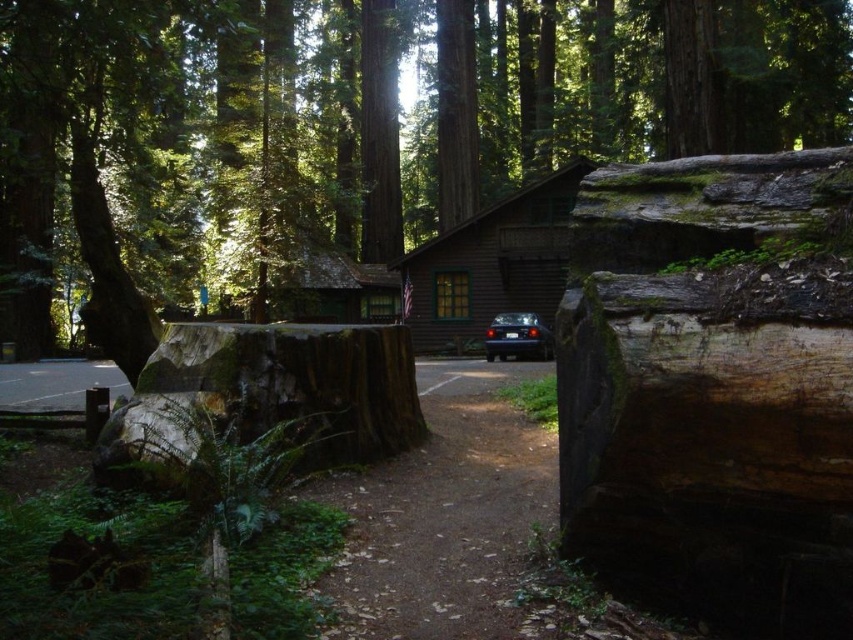
Can you confirm if smooth brown tree trunk at left is thinner than metallic blue car at center?

No.

Does point (100, 264) come in front of point (509, 342)?

Yes.

Describe the element at coordinates (107, 269) in the screenshot. The image size is (853, 640). I see `smooth brown tree trunk at left` at that location.

This screenshot has width=853, height=640. Find the location of `smooth brown tree trunk at left`. smooth brown tree trunk at left is located at coordinates (107, 269).

Does smooth bark log at center appear on the right side of smooth brown tree trunk at left?

Yes, smooth bark log at center is to the right of smooth brown tree trunk at left.

Who is more forward, (703, 8) or (70, 182)?

Point (70, 182)

Locate an element on the screen. This screenshot has height=640, width=853. smooth bark log at center is located at coordinates (347, 138).

Between point (415, 307) and point (538, 348), which one is positioned in front?

Point (538, 348) is in front.

Is point (496, 289) positioned after point (534, 346)?

Yes, point (496, 289) is behind point (534, 346).

Who is more distant from viewer, (431, 342) or (485, 348)?

The point (431, 342) is more distant.

At what (x,y) coordinates should I click in order to perform the action: click on brown wooden cabin at center. Please return your answer as a coordinate pair (x, y). Looking at the image, I should click on (491, 266).